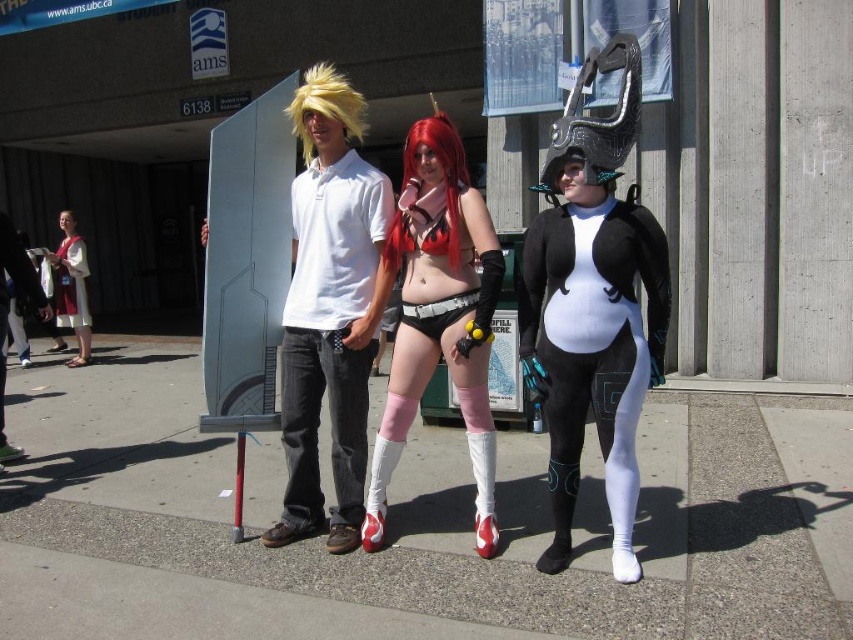
You are designing a costume for a character in a sci fi movie. The costume requires a bodysuit and shorts. Based on the image, which item is wider between the matte black and white bodysuit at center and the matte black shorts at center?

The matte black and white bodysuit at center is wider than the matte black shorts at center according to the description.

You are a photographer setting up for a group photo. The two subjects are wearing a matte black and white bodysuit at center and a shiny red wig at center. You need to ensure there is enough space between them for a lighting setup. Given that your lighting equipment requires at least 24 inches of space between subjects, will the current distance suffice?

The matte black and white bodysuit at center is 24.65 inches from the shiny red wig at center. Since the required space is at least 24 inches, the current distance of 24.65 inches is sufficient for the lighting setup.

You are a photographer trying to capture the shiny red wig at center and the matte black and white bodysuit at center in the same frame. Which object should you adjust your camera to focus on first if you want to ensure both are in focus?

To ensure both the shiny red wig at center and the matte black and white bodysuit at center are in focus, focus on the matte black and white bodysuit at center first since it is farther away from the camera than the shiny red wig at center.